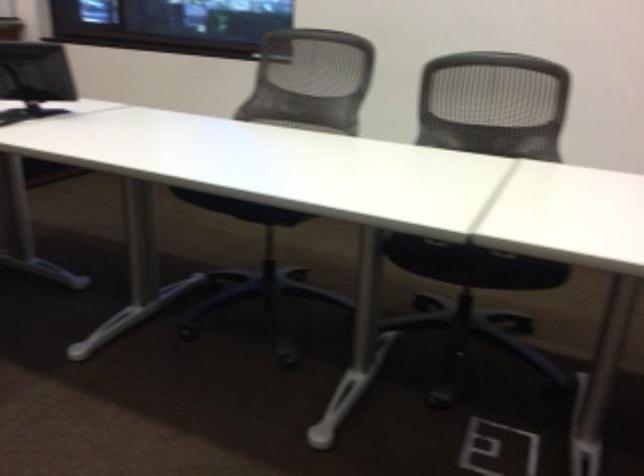
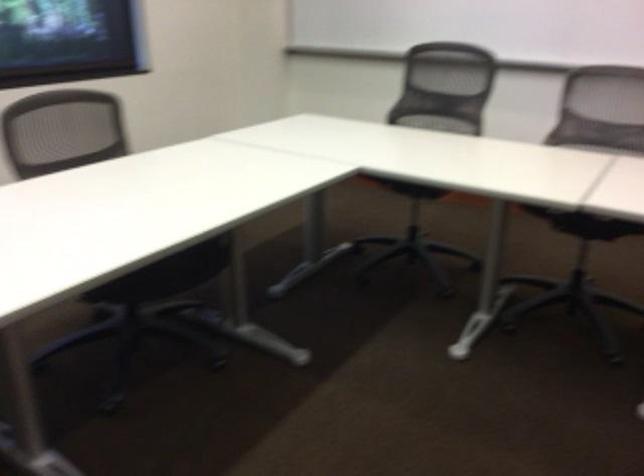
The images are taken continuously from a first-person perspective. In which direction is your viewpoint rotating?

The rotation direction of the camera is right-down.